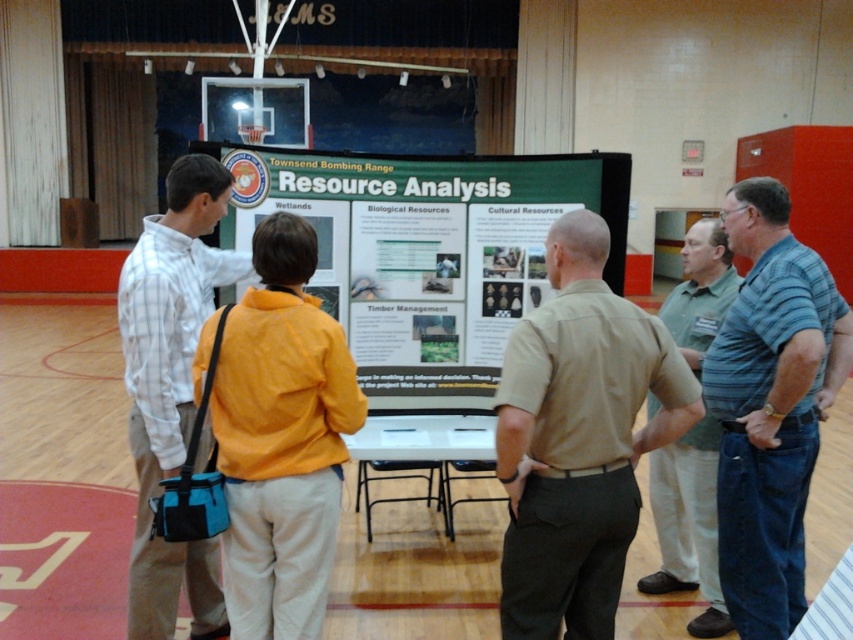
Question: Does tan uniform at center have a smaller size compared to khaki pants at center?

Choices:
 (A) yes
 (B) no

Answer: (B)

Question: Which point is farther from the camera taking this photo?

Choices:
 (A) (309, 403)
 (B) (480, 298)
 (C) (804, 381)
 (D) (189, 212)

Answer: (B)

Question: Among these points, which one is nearest to the camera?

Choices:
 (A) (233, 268)
 (B) (496, 476)
 (C) (270, 634)
 (D) (340, 289)

Answer: (C)

Question: Which object appears farthest from the camera in this image?

Choices:
 (A) khaki uniform shirt at center
 (B) light brown plaid shirt at center

Answer: (A)

Question: Is khaki pants at center in front of khaki uniform shirt at center?

Choices:
 (A) no
 (B) yes

Answer: (B)

Question: Can you confirm if tan uniform at center is smaller than light brown plaid shirt at center?

Choices:
 (A) yes
 (B) no

Answer: (A)